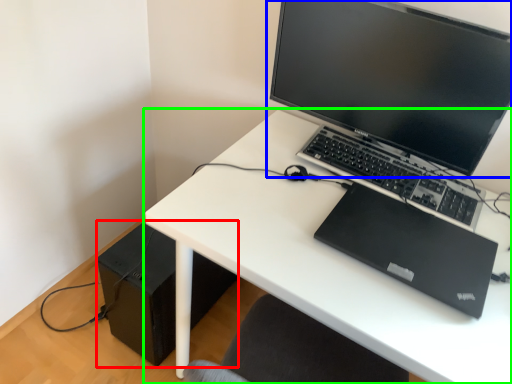
Question: Based on their relative distances, which object is nearer to speaker (highlighted by a red box)? Choose from computer monitor (highlighted by a blue box) and desk (highlighted by a green box).

Choices:
 (A) computer monitor
 (B) desk

Answer: (B)